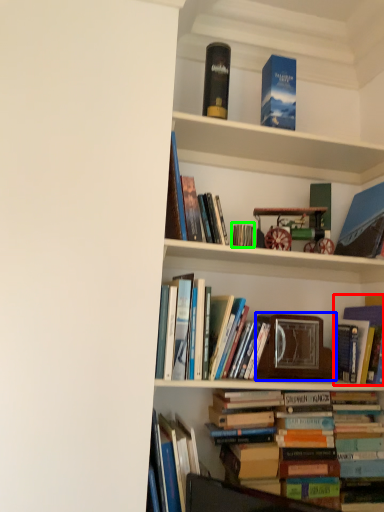
Question: Which object is positioned farthest from book (highlighted by a red box)? Select from picture frame (highlighted by a blue box) and book (highlighted by a green box).

Choices:
 (A) picture frame
 (B) book

Answer: (B)